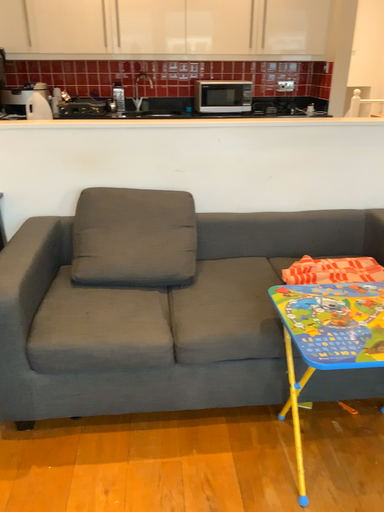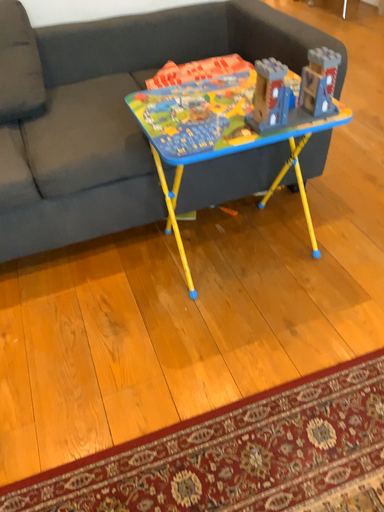
Question: Which way did the camera rotate in the video?

Choices:
 (A) rotated downward
 (B) rotated upward

Answer: (A)